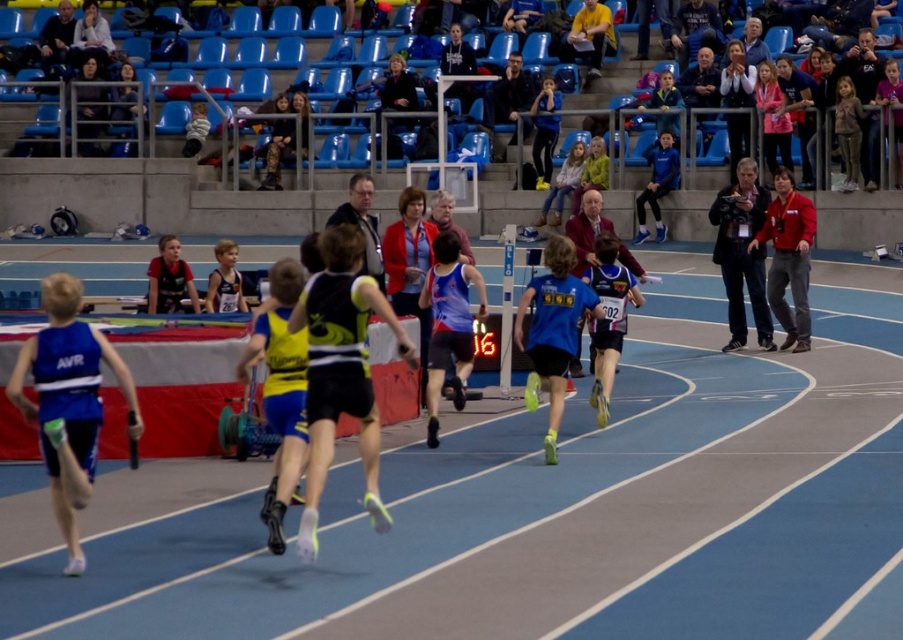
Question: In this image, where is blue matte running suit at left located relative to blue matte running shoe at center?

Choices:
 (A) below
 (B) above

Answer: (A)

Question: Does blue matte running suit at left appear on the left side of matte blue running suit at center?

Choices:
 (A) yes
 (B) no

Answer: (A)

Question: Among these objects, which one is farthest from the camera?

Choices:
 (A) black matte running suit at center
 (B) matte blue running suit at center

Answer: (B)

Question: Which of the following is the farthest from the observer?

Choices:
 (A) (364, 291)
 (B) (603, 92)
 (C) (75, 349)
 (D) (457, 396)

Answer: (B)

Question: Estimate the real-world distances between objects in this image. Which object is closer to the yellow/black mesh running suit at center?

Choices:
 (A) blue matte running suit at left
 (B) dark blue suit at right

Answer: (A)

Question: Can you confirm if yellow/black mesh running suit at center is positioned above blue plastic seats at upper center?

Choices:
 (A) yes
 (B) no

Answer: (B)